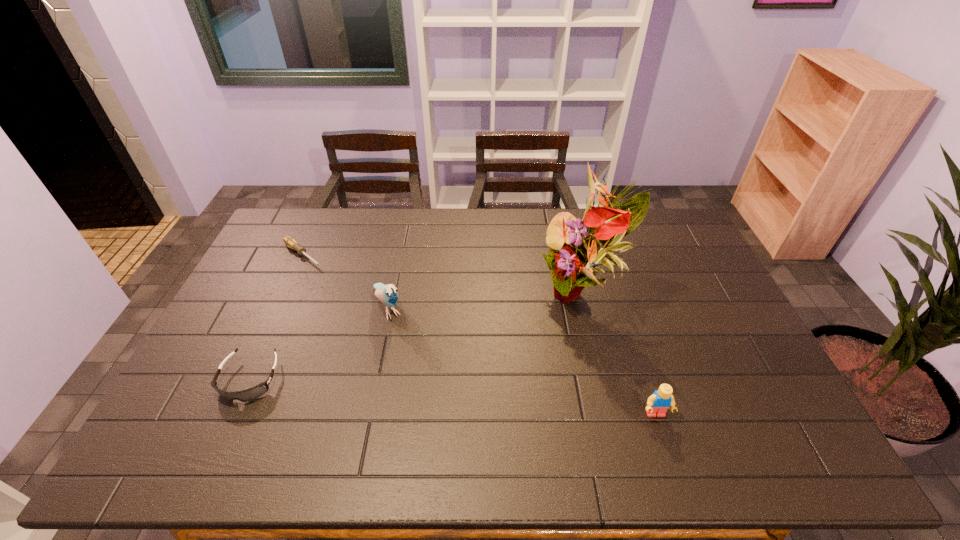
Where is `goggles`? The height and width of the screenshot is (540, 960). goggles is located at coordinates (255, 392).

The image size is (960, 540). What are the coordinates of `the fourth tallest object` in the screenshot? It's located at (255, 392).

Where is `Lego`? Lego is located at coordinates (658, 403).

You are a GUI agent. You are given a task and a screenshot of the screen. Output one action in this format:
    pyautogui.click(x=<x>, y=<y>)
    Task: Click on the third tallest object
    The image size is (960, 540).
    Given the screenshot: What is the action you would take?
    pyautogui.click(x=658, y=403)

This screenshot has height=540, width=960. Identify the location of the tallest object. (575, 252).

The width and height of the screenshot is (960, 540). I want to click on the second tallest object, so click(x=387, y=294).

Find the location of `bird`. bird is located at coordinates (387, 294).

At what (x,y) coordinates should I click in order to perform the action: click on the shortest object. Please return your answer as a coordinate pair (x, y). The height and width of the screenshot is (540, 960). Looking at the image, I should click on (290, 242).

You are a GUI agent. You are given a task and a screenshot of the screen. Output one action in this format:
    pyautogui.click(x=<x>, y=<y>)
    Task: Click on the free space located on the front-facing side of the bouquet
    The width and height of the screenshot is (960, 540).
    Given the screenshot: What is the action you would take?
    pyautogui.click(x=477, y=402)

Find the location of a particular element. Image resolution: width=960 pixels, height=540 pixels. free spot located 0.050m on the front-facing side of the bouquet is located at coordinates (549, 336).